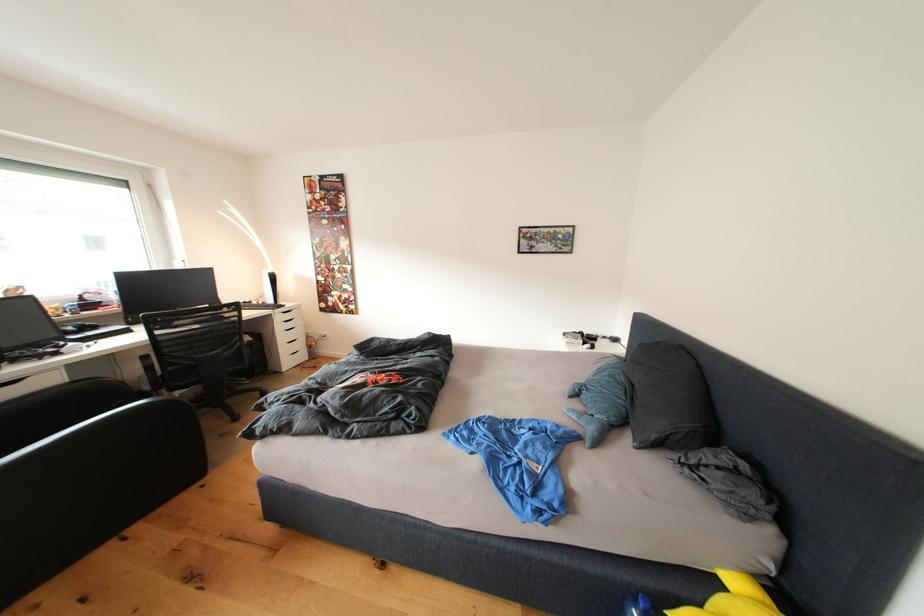
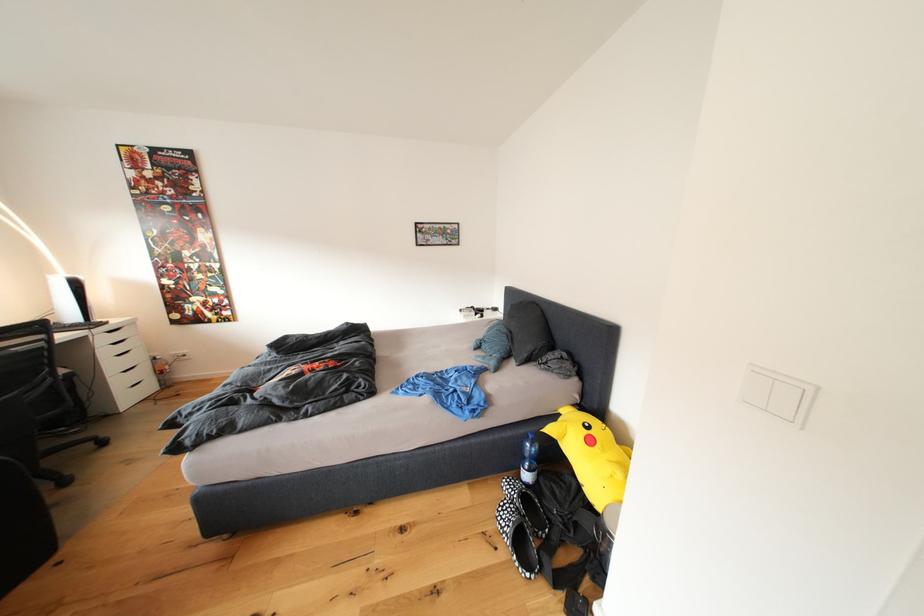
In the second image, find the point that corresponds to the point at 292,342 in the first image.

(120, 370)